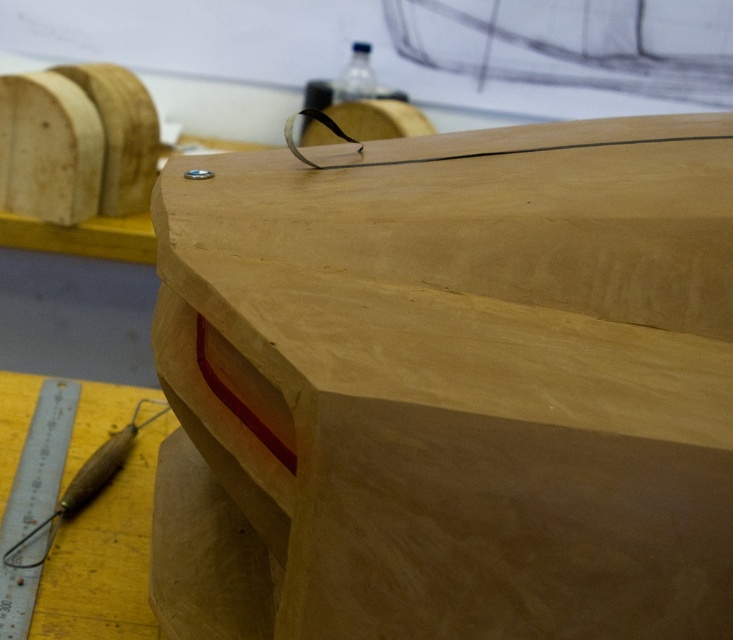
You are an artist working on a wooden sculpture. You have a wooden carving tool at lower left and a transparent plastic bottle at upper center. Which object is located to the left of the other?

The wooden carving tool at lower left is positioned on the left side of transparent plastic bottle at upper center.

You are a woodworker standing 1 meter away from a wooden object. You need to reach the wooden carving tool at lower left to adjust its position. Is the tool within your reach?

The wooden carving tool at lower left is 1.05 meters away from viewer, so it is slightly out of reach since you are standing 1 meter away.